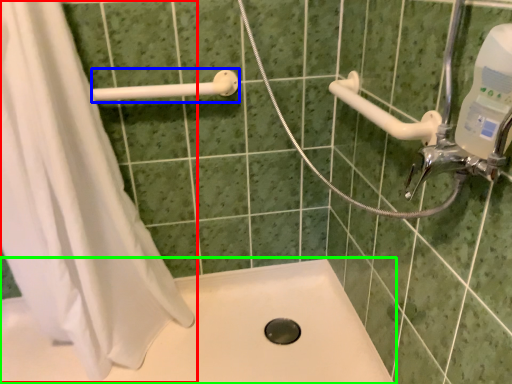
Question: Which object is positioned closest to shower curtain (highlighted by a red box)? Select from shower (highlighted by a blue box) and bath (highlighted by a green box).

Choices:
 (A) shower
 (B) bath

Answer: (B)